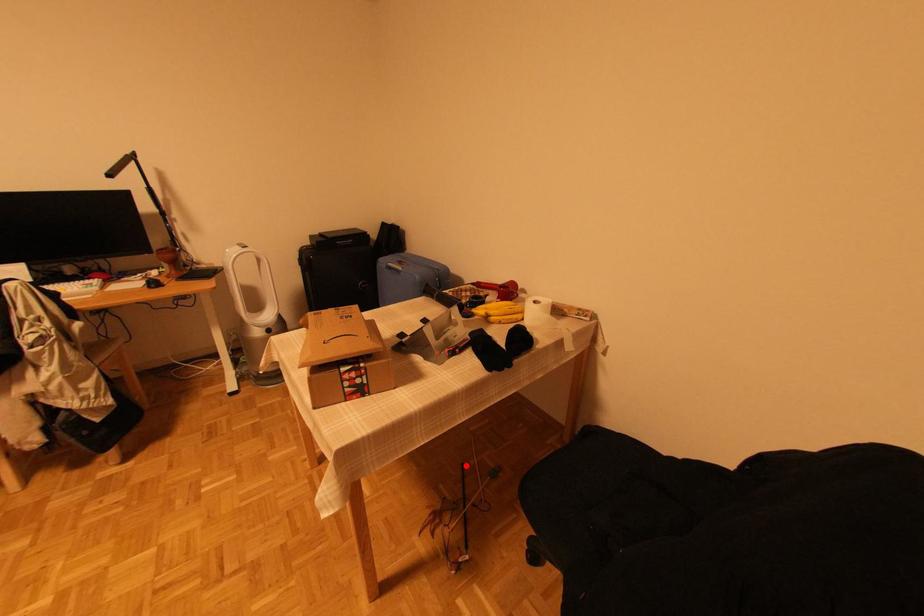
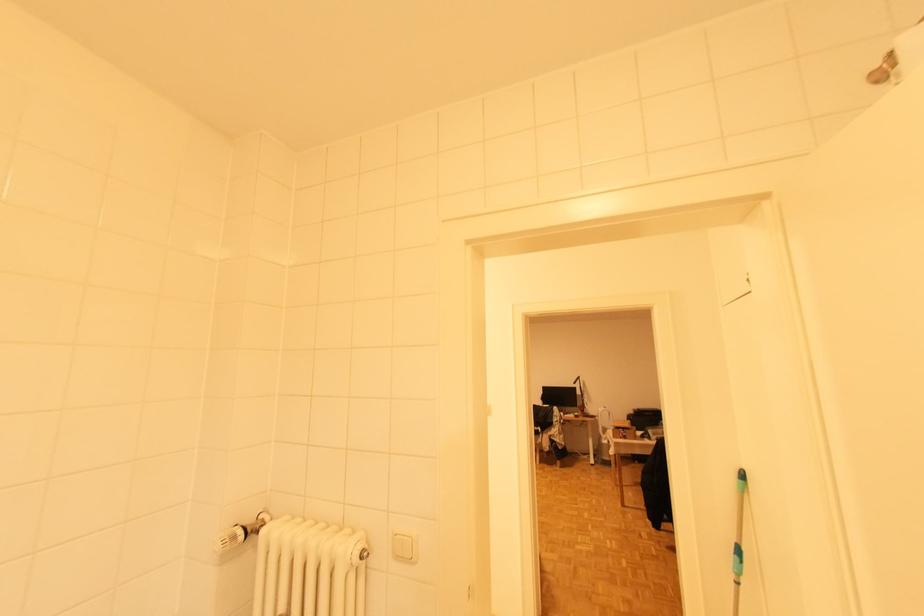
Question: I am providing you with two images of the same scene from different viewpoints. A red point is marked on the first image. At the location where the point appears in image 1, is it still visible in image 2?

Choices:
 (A) Yes
 (B) No

Answer: (B)